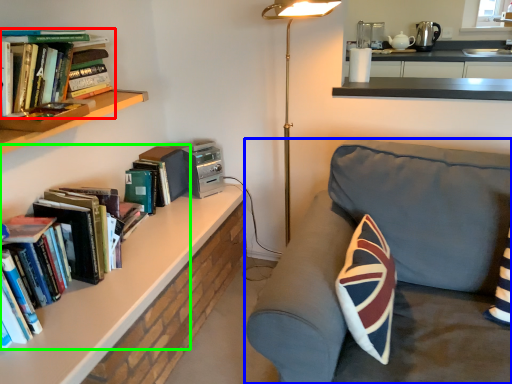
Question: Considering the real-world distances, which object is closest to book (highlighted by a red box)? studio couch (highlighted by a blue box) or book (highlighted by a green box).

Choices:
 (A) studio couch
 (B) book

Answer: (B)